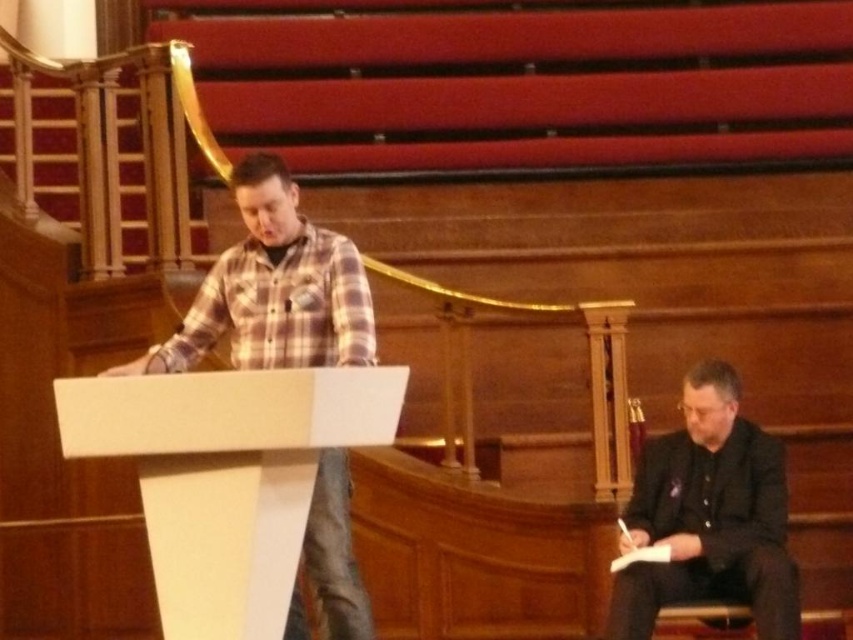
You are a stagehand who needs to move a 20 feet long extension cord from the plaid flannel shirt at center to the black matte suit at lower right. Can you safely stretch the cord between them without it being too short?

The distance between the plaid flannel shirt at center and the black matte suit at lower right is 22.65 feet. Since the extension cord is only 20 feet long, it would be 2.65 feet too short to reach safely.

You are a photographer positioned at the front of the auditorium and need to capture a photo of both the plaid flannel shirt at center and the black matte suit at lower right without any obstructions. Based on their positions, which subject should you adjust to ensure both are fully visible in the frame?

The black matte suit at lower right is behind the plaid flanel shirt at center. To ensure both are visible, you should move the plaid flanel shirt at center forward so it doesn not block the black matte suit at lower right.

You are standing at the entrance of the lecture hall and see the point marked at coordinates (273, 289). What object is located at that point?

The point at coordinates (273, 289) indicates the plaid flannel shirt at center.